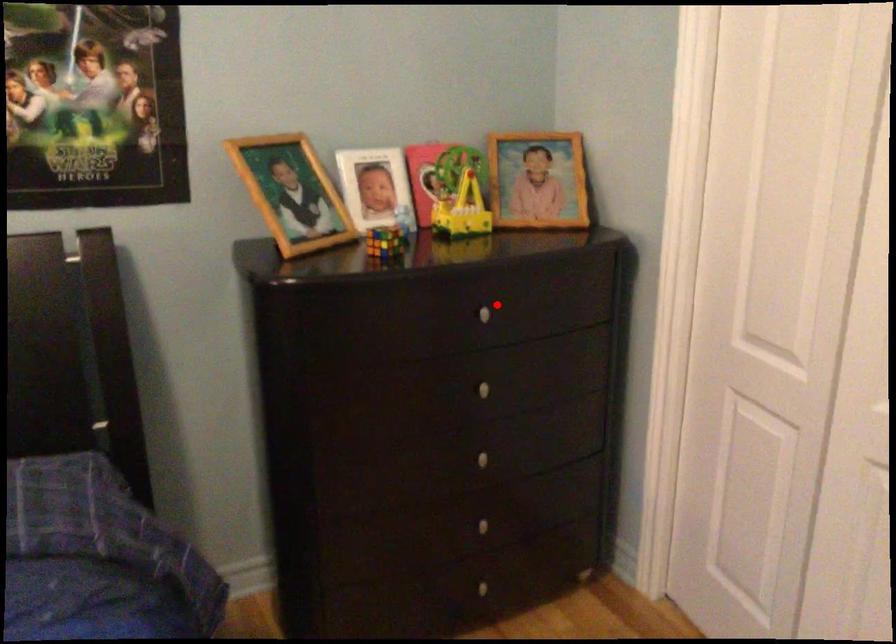
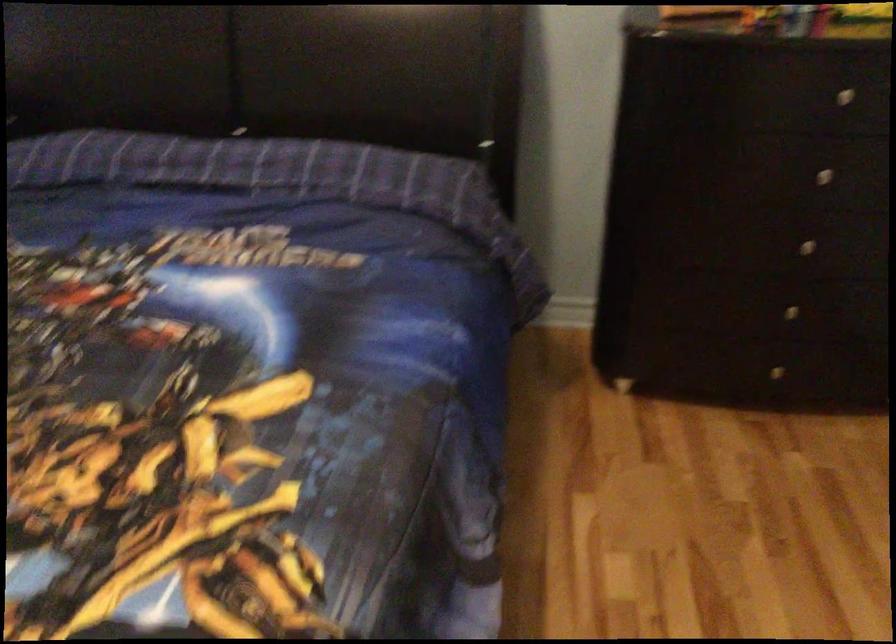
The point at the highlighted location is marked in the first image. Where is the corresponding point in the second image?

(858, 91)